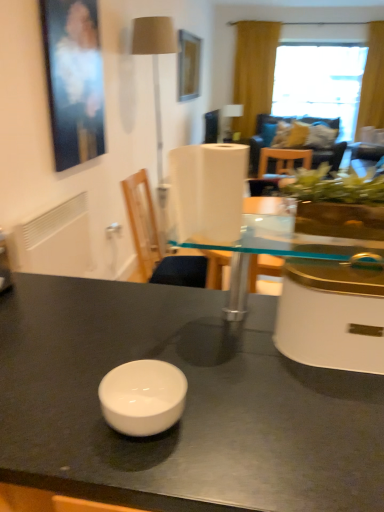
This screenshot has width=384, height=512. I want to click on vacant space in between white glossy bowl at center and transparent glass table at center, so click(228, 361).